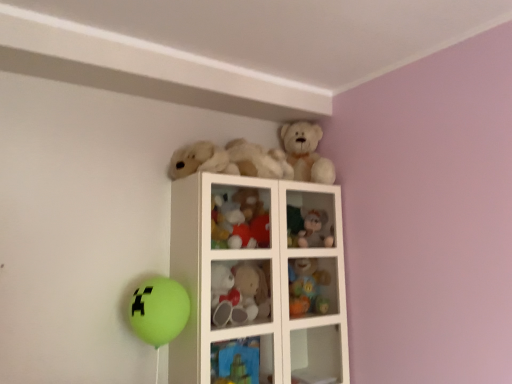
Question: In which direction should I rotate to look at blue fabric toy at upper center, the second cabinet positioned from the back?

Choices:
 (A) right
 (B) left

Answer: (B)

Question: Is the depth of blue fabric toy at upper center, the 1th cabinet when ordered from front to back, less than that of white plush bear at upper center, which appears as the 5th toy when ordered from the bottom?

Choices:
 (A) no
 (B) yes

Answer: (B)

Question: Considering the relative sizes of blue fabric toy at upper center, the second cabinet viewed from the top, and white plush bear at upper center, which appears as the 5th toy when ordered from the bottom, in the image provided, is blue fabric toy at upper center, the second cabinet viewed from the top, wider than white plush bear at upper center, which appears as the 5th toy when ordered from the bottom,?

Choices:
 (A) no
 (B) yes

Answer: (A)

Question: Is blue fabric toy at upper center, the 1th cabinet when ordered from front to back, bigger than white plush bear at upper center, the first toy viewed from the top?

Choices:
 (A) yes
 (B) no

Answer: (B)

Question: Is blue fabric toy at upper center, the first cabinet in the bottom-to-top sequence, turned away from white plush bear at upper center, which appears as the 5th toy when ordered from the bottom?

Choices:
 (A) no
 (B) yes

Answer: (A)

Question: Can you confirm if blue fabric toy at upper center, the second cabinet positioned from the back, is taller than white plush bear at upper center, the first toy viewed from the top?

Choices:
 (A) yes
 (B) no

Answer: (B)

Question: From a real-world perspective, is blue fabric toy at upper center, the second cabinet viewed from the top, located higher than white plush bear at upper center, which appears as the 5th toy when ordered from the bottom?

Choices:
 (A) yes
 (B) no

Answer: (B)

Question: From a real-world perspective, is fuzzy fabric teddy bear at upper center, the second cabinet in the bottom-to-top sequence, on white glass cabinet at upper center?

Choices:
 (A) yes
 (B) no

Answer: (A)

Question: Considering the relative sizes of fuzzy fabric teddy bear at upper center, the first cabinet positioned from the top, and white glass cabinet at upper center in the image provided, is fuzzy fabric teddy bear at upper center, the first cabinet positioned from the top, shorter than white glass cabinet at upper center?

Choices:
 (A) no
 (B) yes

Answer: (B)

Question: Is fuzzy fabric teddy bear at upper center, the first cabinet positioned from the top, thinner than white glass cabinet at upper center?

Choices:
 (A) yes
 (B) no

Answer: (A)

Question: Considering the relative positions of fuzzy fabric teddy bear at upper center, which is the second cabinet in left-to-right order, and white glass cabinet at upper center in the image provided, is fuzzy fabric teddy bear at upper center, which is the second cabinet in left-to-right order, to the left of white glass cabinet at upper center from the viewer's perspective?

Choices:
 (A) yes
 (B) no

Answer: (B)

Question: Does fuzzy fabric teddy bear at upper center, the first cabinet when ordered from back to front, have a greater width compared to white glass cabinet at upper center?

Choices:
 (A) no
 (B) yes

Answer: (A)

Question: Is fuzzy fabric teddy bear at upper center, the second cabinet in the bottom-to-top sequence, looking in the opposite direction of white glass cabinet at upper center?

Choices:
 (A) yes
 (B) no

Answer: (A)

Question: Is blue fabric toy at upper center, arranged as the 2th cabinet when viewed from the right, taller than white glass cabinet at upper center?

Choices:
 (A) yes
 (B) no

Answer: (B)